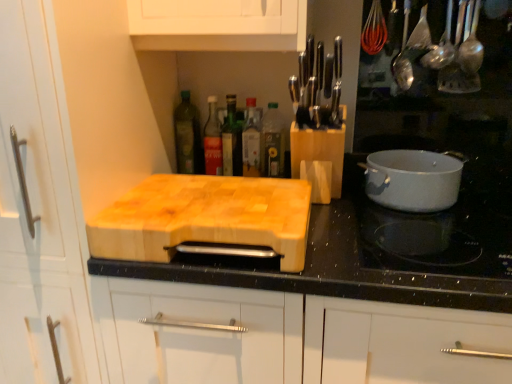
Question: From a real-world perspective, is green glass bottle at center, arranged as the 3th bottle when viewed from the right, on white glossy pot at right?

Choices:
 (A) no
 (B) yes

Answer: (B)

Question: Does green glass bottle at center, arranged as the 3th bottle when viewed from the right, contain white glossy pot at right?

Choices:
 (A) no
 (B) yes

Answer: (A)

Question: Considering the relative sizes of green glass bottle at center, which is the third bottle in left-to-right order, and white glossy pot at right in the image provided, is green glass bottle at center, which is the third bottle in left-to-right order, thinner than white glossy pot at right?

Choices:
 (A) yes
 (B) no

Answer: (A)

Question: Can you confirm if green glass bottle at center, which is the third bottle in left-to-right order, is smaller than white glossy pot at right?

Choices:
 (A) yes
 (B) no

Answer: (A)

Question: Is green glass bottle at center, arranged as the 3th bottle when viewed from the right, at the right side of white glossy pot at right?

Choices:
 (A) yes
 (B) no

Answer: (B)

Question: Is green glass bottle at center, arranged as the 3th bottle when viewed from the right, oriented away from white glossy pot at right?

Choices:
 (A) yes
 (B) no

Answer: (B)

Question: Is natural wood cutting board at center at the back of clear glass bottle at center, the fourth bottle when ordered from left to right?

Choices:
 (A) yes
 (B) no

Answer: (B)

Question: Is clear glass bottle at center, acting as the 2th bottle starting from the right, smaller than natural wood cutting board at center?

Choices:
 (A) yes
 (B) no

Answer: (A)

Question: Considering the relative sizes of clear glass bottle at center, acting as the 2th bottle starting from the right, and natural wood cutting board at center in the image provided, is clear glass bottle at center, acting as the 2th bottle starting from the right, taller than natural wood cutting board at center?

Choices:
 (A) no
 (B) yes

Answer: (A)

Question: Considering the relative positions of clear glass bottle at center, acting as the 2th bottle starting from the right, and natural wood cutting board at center in the image provided, is clear glass bottle at center, acting as the 2th bottle starting from the right, to the left of natural wood cutting board at center from the viewer's perspective?

Choices:
 (A) no
 (B) yes

Answer: (A)

Question: Is clear glass bottle at center, acting as the 2th bottle starting from the right, at the right side of natural wood cutting board at center?

Choices:
 (A) no
 (B) yes

Answer: (B)

Question: Is clear glass bottle at center, acting as the 2th bottle starting from the right, behind natural wood cutting board at center?

Choices:
 (A) yes
 (B) no

Answer: (A)

Question: Is the surface of natural wood cutting board at center in direct contact with green glass bottle at upper center, which is the first bottle from left to right?

Choices:
 (A) no
 (B) yes

Answer: (A)